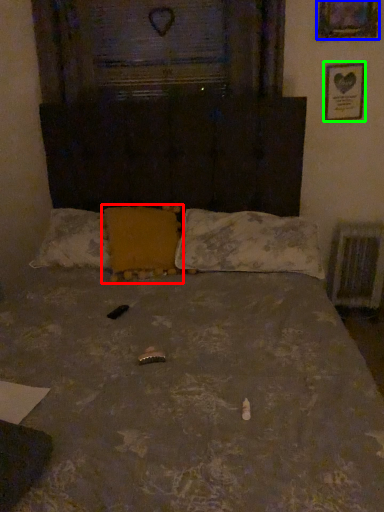
Question: Which object is positioned farthest from pillow (highlighted by a red box)? Select from picture frame (highlighted by a blue box) and picture frame (highlighted by a green box).

Choices:
 (A) picture frame
 (B) picture frame

Answer: (A)